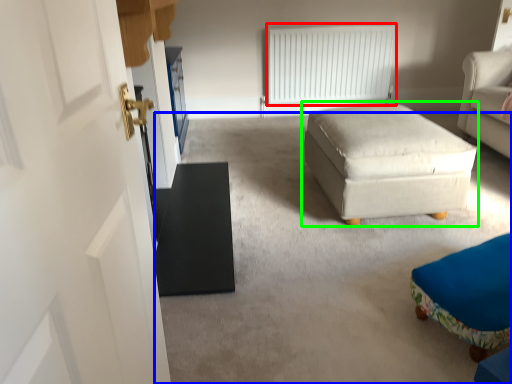
Question: Based on their relative distances, which object is farther from radiator (highlighted by a red box)? Choose from plain (highlighted by a blue box) and table (highlighted by a green box).

Choices:
 (A) plain
 (B) table

Answer: (A)